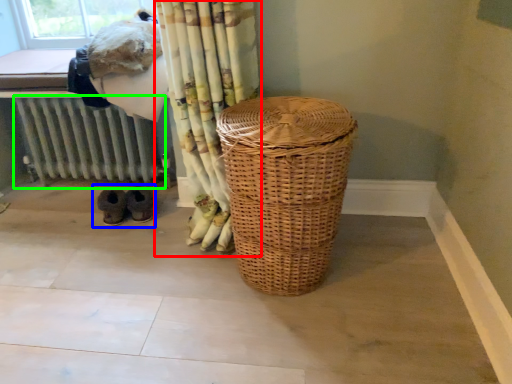
Question: Based on their relative distances, which object is nearer to curtain (highlighted by a red box)? Choose from footwear (highlighted by a blue box) and radiator (highlighted by a green box).

Choices:
 (A) footwear
 (B) radiator

Answer: (A)